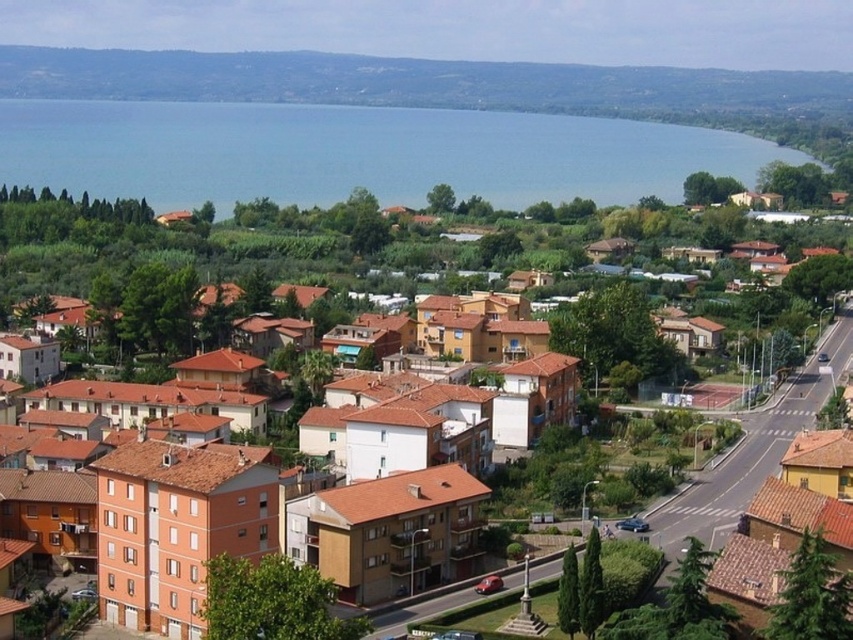
You are standing at the edge of the coastal area looking out towards the water. There is a point marked at coordinates (357, 154). Based on the scene description, can you determine whether this point is located on the blue water at center or on the buildings with terracotta roofs in the foreground?

The point at coordinates (357, 154) is located on the blue water at center, as stated in the Objects Description.

Consider the image. You are a photographer planning to capture the entire scene of the coastal residential area. You have a camera with a standard lens that can only focus on objects within a 100m radius. Given that the blue water at center and brown brick houses at center are both within this range, which object will occupy more space in your final photo?

The blue water at center will occupy more space in the final photo because it is larger in size than the brown brick houses at center according to the description.